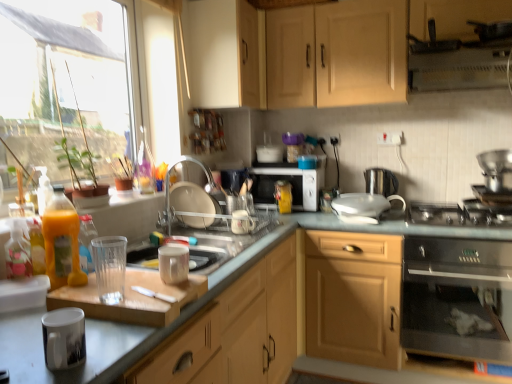
Question: From the image's perspective, is transparent glass window at left located above or below glossy ceramic mug at lower left, the first appliance from the front?

Choices:
 (A) below
 (B) above

Answer: (B)

Question: Is point (20, 117) closer or farther from the camera than point (53, 324)?

Choices:
 (A) closer
 (B) farther

Answer: (B)

Question: Based on their relative distances, which object is nearer to the white glossy faucet at center?

Choices:
 (A) translucent plastic bottle at left, placed as the 2th bottle when sorted from front to back
 (B) transparent plastic cup at lower left, acting as the second appliance starting from the front
 (C) translucent plastic bottle at center, the 1th bottle when ordered from right to left
 (D) metallic silver coffee maker at upper right, acting as the eighth appliance starting from the left
 (E) translucent plastic bottle at left, positioned as the 3th bottle in back-to-front order

Answer: (A)

Question: Estimate the real-world distances between objects in this image. Which object is closer to the white matte cabinet at upper center, which appears as the second cabinetry when ordered from the bottom?

Choices:
 (A) white glossy faucet at center
 (B) glossy ceramic mug at lower left, which is the first appliance in left-to-right order
 (C) matte wood cabinet at center, which is counted as the 3th cabinetry, starting from the top
 (D) matte wood cabinets at upper center, positioned as the third cabinetry in bottom-to-top order
 (E) stainless steel gas stove at lower right

Answer: (D)